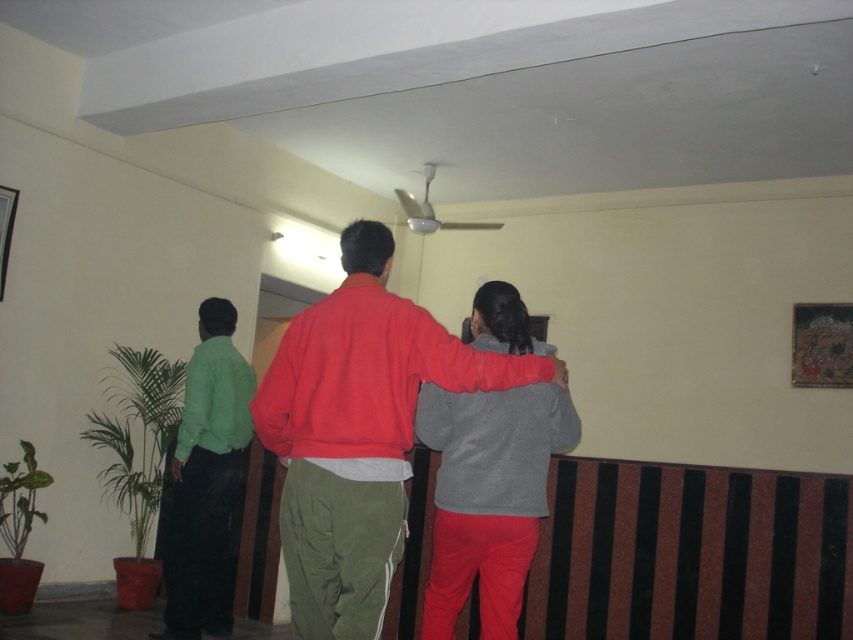
You are trying to locate the red matte sweatshirt at center in the indoor scene. Given that the coordinate system starts at the bottom left corner of the image, can you determine its position relative to the center of the image?

The red matte sweatshirt at center is located at point coordinates approximately 0.675 on the x axis and 0.421 on the y axis, which is to the right and slightly below the center of the image.

Looking at this image, you are trying to find the red matte sweatshirt at center in the image. Based on the scene description, where would you look relative to the green fabric shirt at left?

The red matte sweatshirt at center is located above the green fabric shirt at left, so you should look upwards from the green fabric shirt at left to find it.

You are standing in the room and want to hand a book to the person wearing the red matte sweatshirt at center. If you can reach up to 2 meters, will you be able to reach them?

The red matte sweatshirt at center and viewer are 2.40 meters apart, so you cannot reach them as the distance exceeds your 2 meters reach.